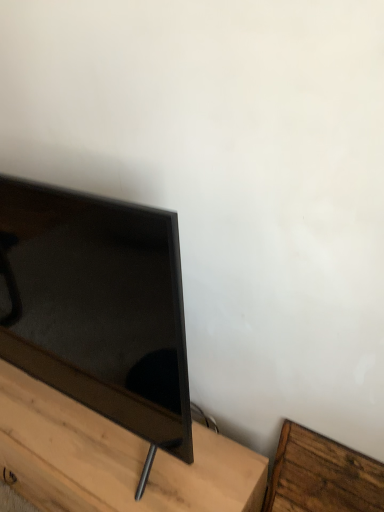
The image size is (384, 512). I want to click on free point above matte black tv stand at lower left, the 2th furniture in the right-to-left sequence (from a real-world perspective), so click(x=77, y=429).